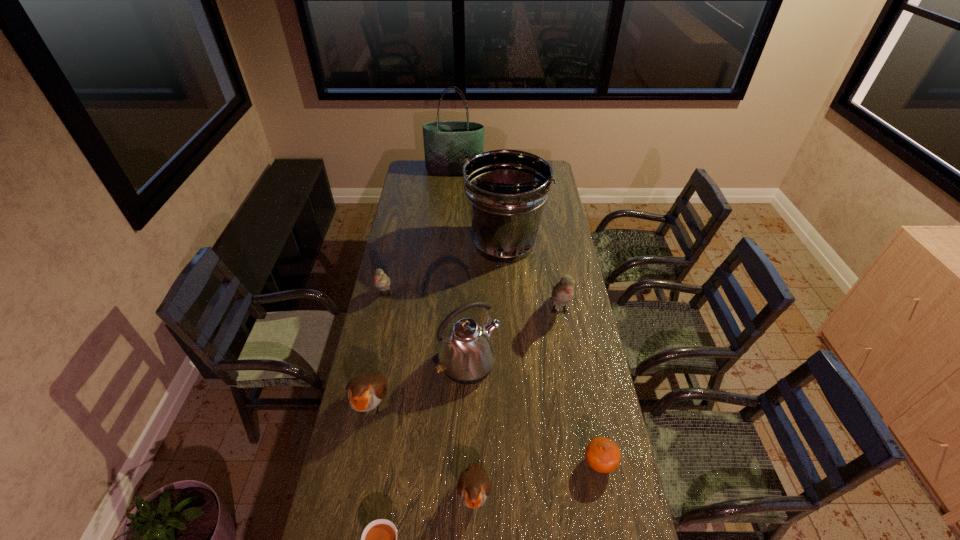
At what (x,y) coordinates should I click in order to perform the action: click on object that is at the far edge. Please return your answer as a coordinate pair (x, y). Looking at the image, I should click on click(445, 142).

Find the location of a particular element. tote bag that is at the left edge is located at coordinates [445, 142].

Image resolution: width=960 pixels, height=540 pixels. What are the coordinates of `bucket situated at the right edge` in the screenshot? It's located at (506, 190).

The height and width of the screenshot is (540, 960). Find the location of `bird that is at the right edge`. bird that is at the right edge is located at coordinates (563, 292).

This screenshot has width=960, height=540. Find the location of `orange positioned at the right edge`. orange positioned at the right edge is located at coordinates (602, 454).

I want to click on object that is at the far left corner, so click(x=445, y=142).

Where is `vacant point at the left edge`? The image size is (960, 540). vacant point at the left edge is located at coordinates (x=377, y=326).

At what (x,y) coordinates should I click in order to perform the action: click on free space at the right edge of the desktop. Please return your answer as a coordinate pair (x, y). Looking at the image, I should click on (585, 383).

The image size is (960, 540). Identify the location of free point between the smaller brown bird and the third tallest object. (471, 429).

The width and height of the screenshot is (960, 540). Identify the location of free space between the orange orange and the eighth nearest object. (551, 353).